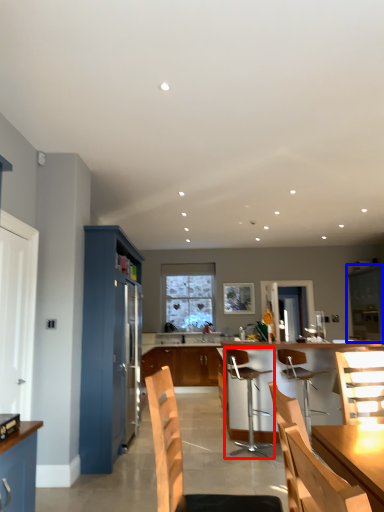
Question: Which of the following is the farthest to the observer, chair (highlighted by a red box) or cabinetry (highlighted by a blue box)?

Choices:
 (A) chair
 (B) cabinetry

Answer: (B)